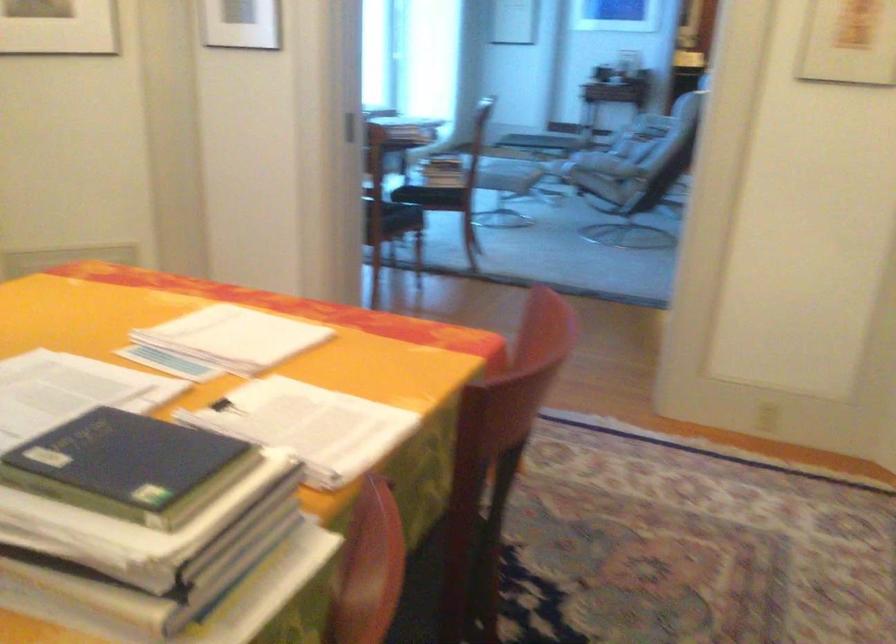
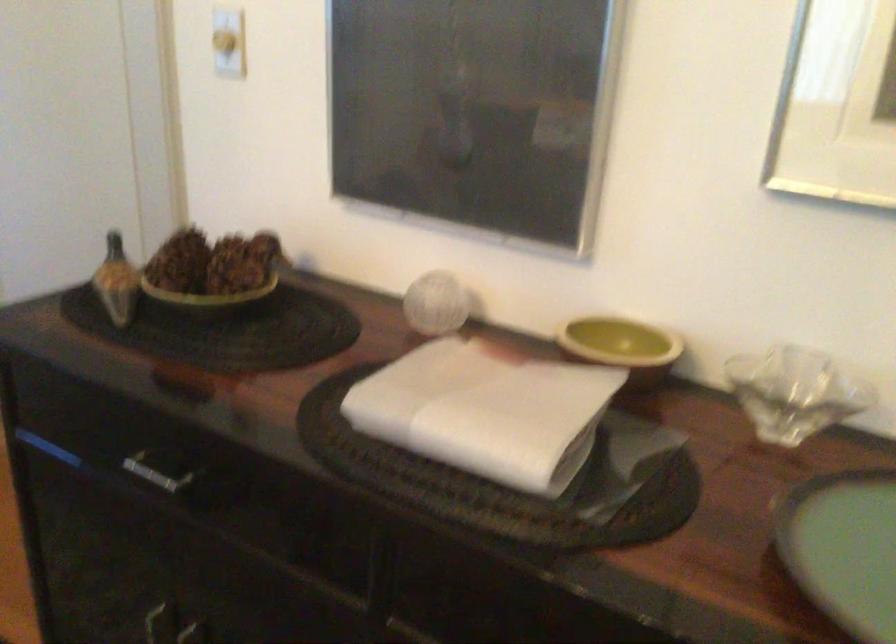
The images are taken continuously from a first-person perspective. In which direction is your viewpoint rotating?

The rotation direction of the camera is right-down.